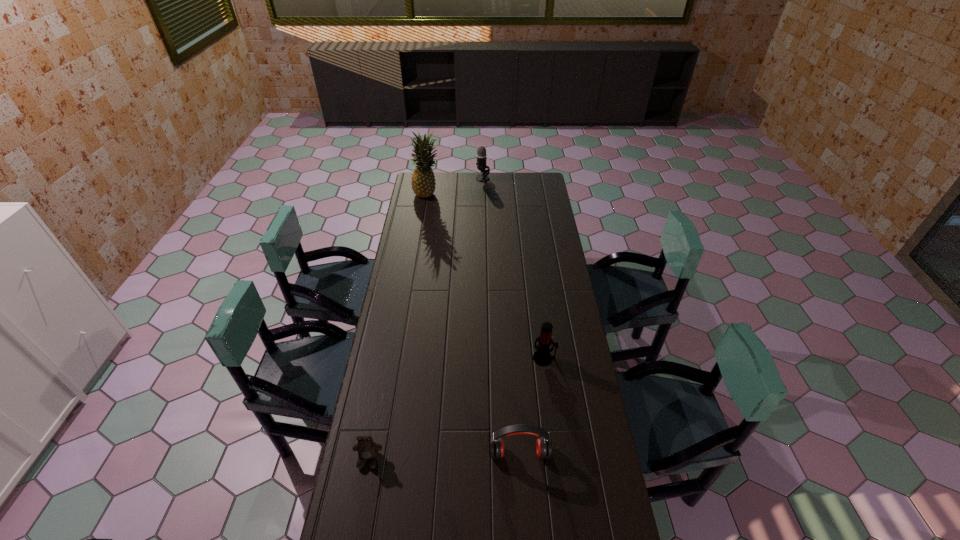
Locate an element on the screen. the tallest object is located at coordinates [x=423, y=182].

Identify the location of pineapple. This screenshot has width=960, height=540. (423, 182).

The image size is (960, 540). Identify the location of the farthest object. (481, 151).

This screenshot has height=540, width=960. Identify the location of the left microphone. (481, 151).

I want to click on the right microphone, so click(x=542, y=356).

Where is `the nearer microphone`? the nearer microphone is located at coordinates (542, 356).

Where is `earphone`? This screenshot has height=540, width=960. earphone is located at coordinates (543, 445).

I want to click on the shortest object, so click(x=367, y=449).

In order to click on vacant point located 0.050m on the right of the pineapple in this screenshot , I will do `click(450, 194)`.

This screenshot has width=960, height=540. I want to click on vacant area situated 0.160m on the front of the left microphone, so click(x=483, y=197).